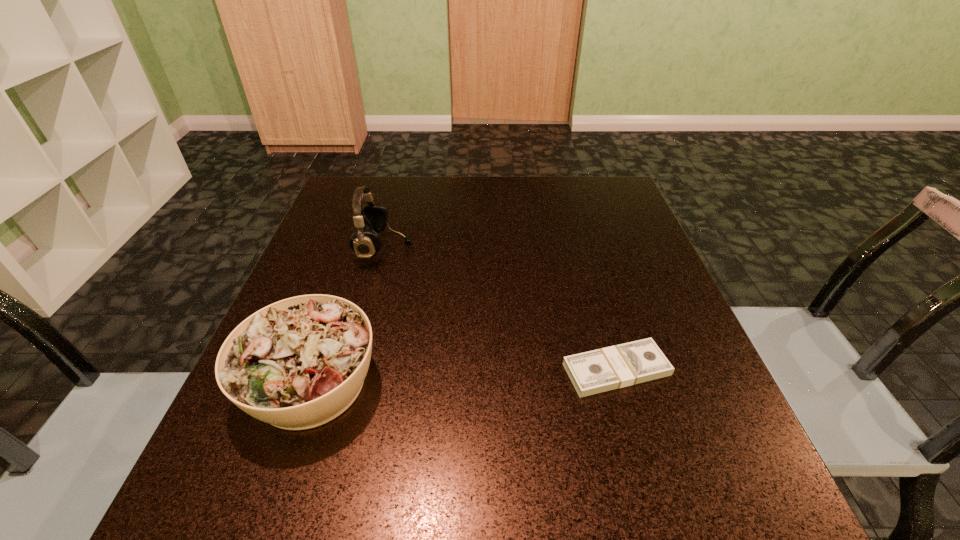
In order to click on object located in the right edge section of the desktop in this screenshot , I will do `click(618, 366)`.

Locate an element on the screen. vacant space at the far edge is located at coordinates (537, 225).

What are the coordinates of `free space at the near edge of the desktop` in the screenshot? It's located at (636, 527).

Where is `free space at the left edge of the desktop`? This screenshot has width=960, height=540. free space at the left edge of the desktop is located at coordinates (343, 240).

The width and height of the screenshot is (960, 540). Find the location of `free location at the right edge`. free location at the right edge is located at coordinates (706, 397).

This screenshot has width=960, height=540. I want to click on vacant area at the far left corner of the desktop, so click(388, 204).

Locate an element on the screen. vacant region at the far right corner of the desktop is located at coordinates (613, 215).

Where is `unoccupied area between the second shortest object and the shortest object`? This screenshot has height=540, width=960. unoccupied area between the second shortest object and the shortest object is located at coordinates (464, 376).

The height and width of the screenshot is (540, 960). I want to click on free spot between the shortest object and the second tallest object, so click(464, 376).

You are a GUI agent. You are given a task and a screenshot of the screen. Output one action in this format:
    pyautogui.click(x=<x>, y=<y>)
    Task: Click on the vacant region between the shortest object and the headset
    
    Given the screenshot: What is the action you would take?
    pyautogui.click(x=500, y=308)